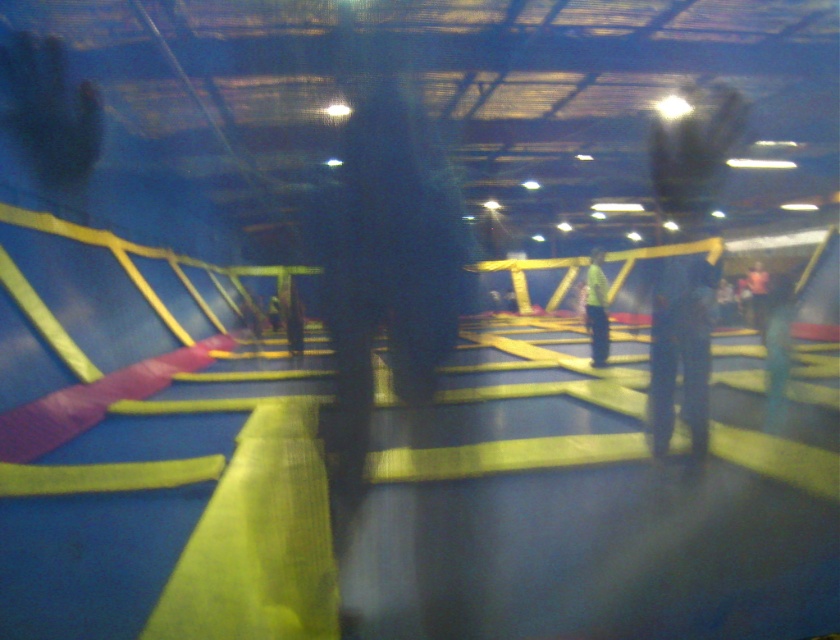
You are a customer at the trampoline park and want to jump from the yellow matte shirt at center to the dark brown leather jacket at center. Can you safely make this jump without hitting anything? Explain your reasoning based on the distance between them.

The yellow matte shirt at center and dark brown leather jacket at center are 16.14 feet apart from each other. Since the distance is quite large, jumping between them might be challenging and could result in hitting obstacles or losing balance. It is not recommended to attempt this jump safely without proper training or equipment.